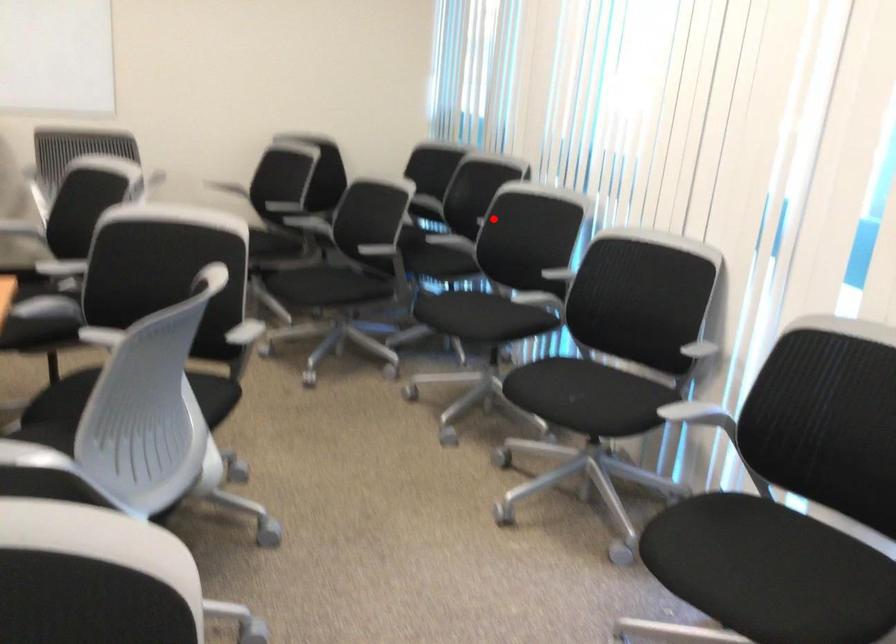
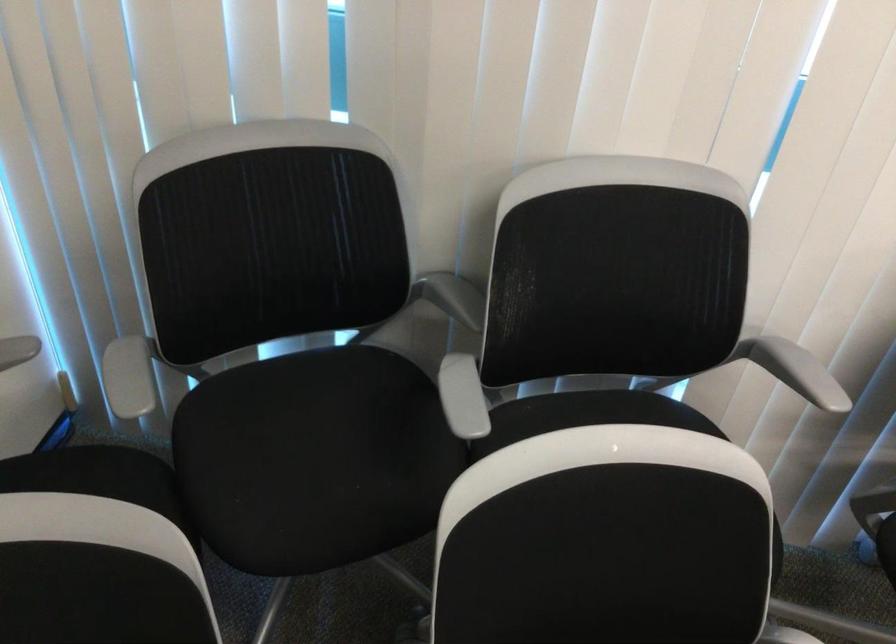
Question: I am providing you with two images of the same scene from different viewpoints. Image1 has a red point marked. In image2, the corresponding 3D location appears at what relative position? Reply with the corresponding letter.

Choices:
 (A) Closer
 (B) Farther

Answer: (A)